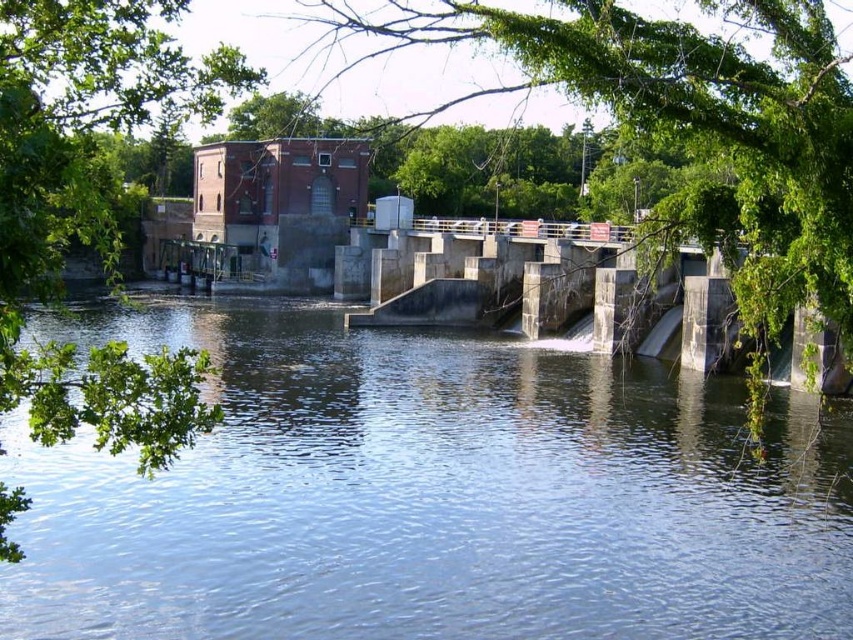
Does clear water at center have a lesser height compared to green leafy tree at upper center?

Yes, clear water at center is shorter than green leafy tree at upper center.

Does point (73, 625) lie in front of point (306, 51)?

That is True.

This screenshot has width=853, height=640. What are the coordinates of `clear water at center` in the screenshot? It's located at (430, 496).

Is point (544, 602) behind point (123, 108)?

Yes, it is.

Which is below, clear water at center or green leafy tree at left?

clear water at center

Is point (218, 618) farther from camera compared to point (32, 205)?

Yes, point (218, 618) is behind point (32, 205).

Where is `clear water at center`? clear water at center is located at coordinates (430, 496).

Does green leafy tree at upper center appear on the right side of green leafy tree at left?

Correct, you'll find green leafy tree at upper center to the right of green leafy tree at left.

Is green leafy tree at upper center thinner than green leafy tree at left?

No, green leafy tree at upper center is not thinner than green leafy tree at left.

The width and height of the screenshot is (853, 640). What do you see at coordinates (683, 125) in the screenshot?
I see `green leafy tree at upper center` at bounding box center [683, 125].

The image size is (853, 640). I want to click on green leafy tree at upper center, so click(683, 125).